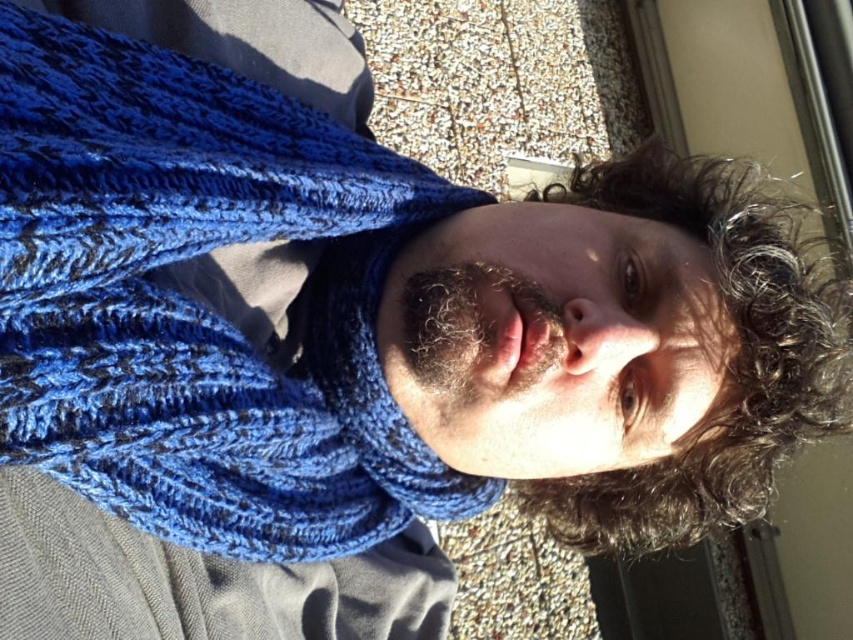
Question: Which point is farther to the camera?

Choices:
 (A) blue knitted scarf at center
 (B) curly brown hair at upper right

Answer: (B)

Question: In this image, where is blue knitted scarf at center located relative to curly brown hair at upper right?

Choices:
 (A) below
 (B) above

Answer: (A)

Question: Which of the following is the farthest from the observer?

Choices:
 (A) (709, 227)
 (B) (276, 484)

Answer: (A)

Question: Can you confirm if blue knitted scarf at center is wider than curly brown hair at upper right?

Choices:
 (A) yes
 (B) no

Answer: (B)

Question: Considering the relative positions of blue knitted scarf at center and curly brown hair at upper right in the image provided, where is blue knitted scarf at center located with respect to curly brown hair at upper right?

Choices:
 (A) above
 (B) below

Answer: (B)